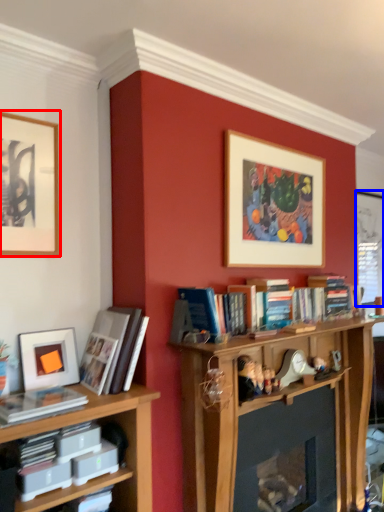
Question: Which point is closer to the camera, picture frame (highlighted by a red box) or window screen (highlighted by a blue box)?

Choices:
 (A) picture frame
 (B) window screen

Answer: (A)